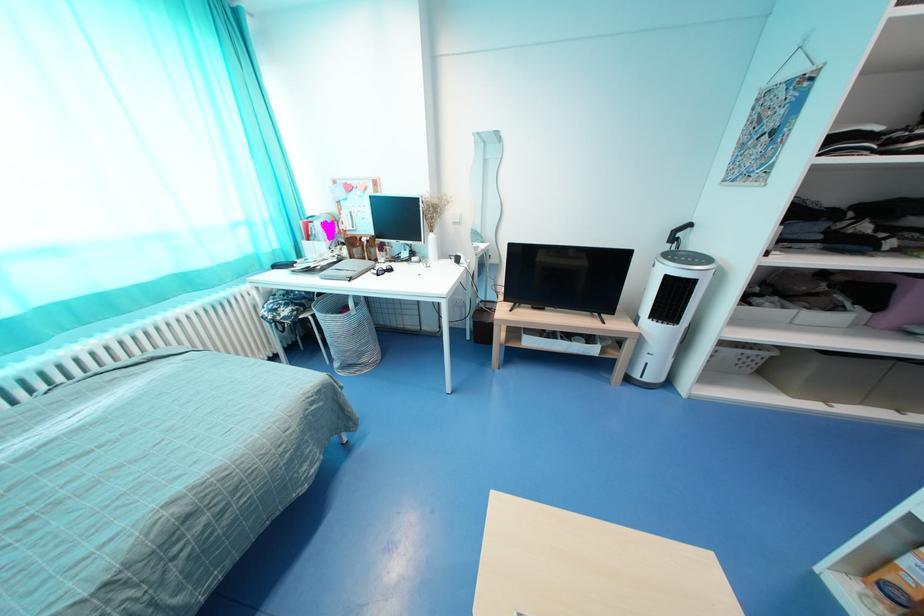
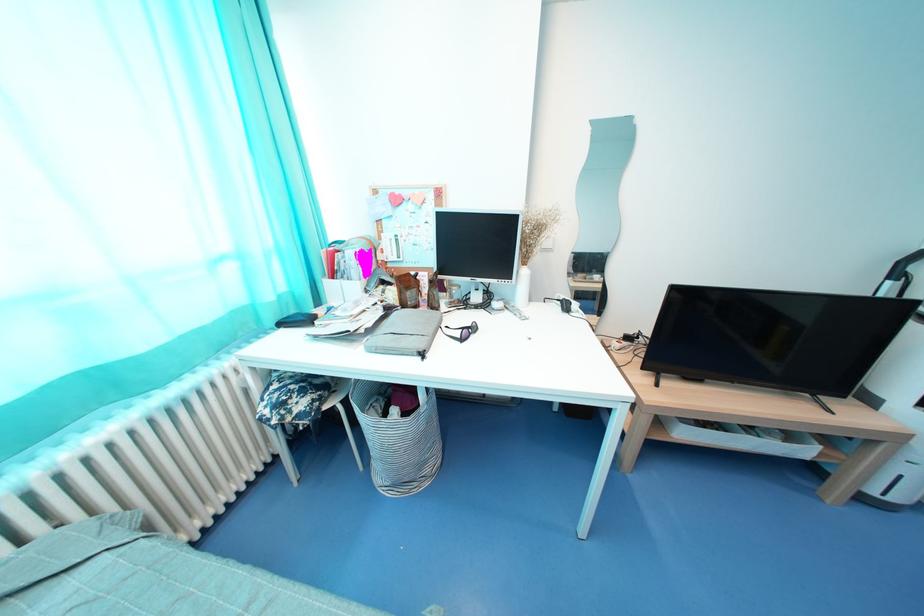
From the picture: Which direction would the cameraman need to move to produce the second image?

The cameraman walked toward left, forward.